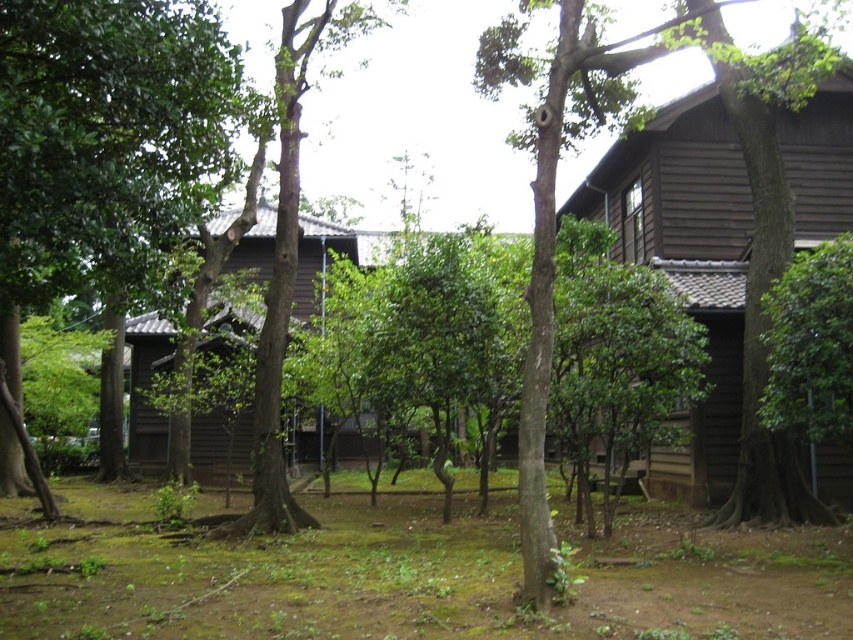
Question: Does green leafy tree at center have a larger size compared to brown wooden hut at center?

Choices:
 (A) no
 (B) yes

Answer: (A)

Question: Based on their relative distances, which object is farther from the wooden hut at right?

Choices:
 (A) green mossy ground at center
 (B) green leafy tree at center

Answer: (B)

Question: Which object is farther from the camera taking this photo?

Choices:
 (A) wooden hut at right
 (B) green matte tree at center
 (C) green mossy ground at center

Answer: (A)

Question: Does wooden hut at right have a greater width compared to green matte tree at center?

Choices:
 (A) yes
 (B) no

Answer: (B)

Question: Is wooden hut at right below brown wooden hut at center?

Choices:
 (A) no
 (B) yes

Answer: (A)

Question: Among these objects, which one is farthest from the camera?

Choices:
 (A) brown wooden hut at center
 (B) green mossy ground at center

Answer: (A)